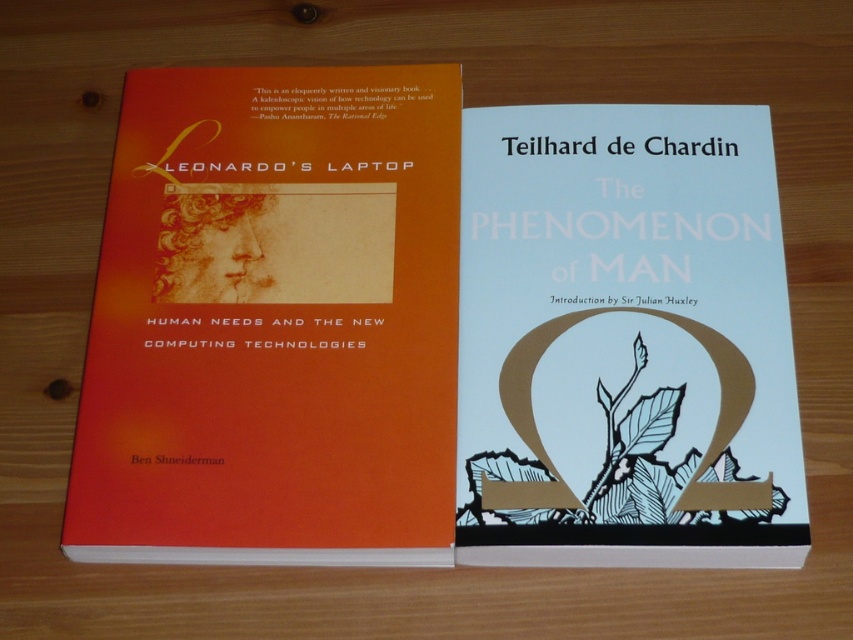
You have a bookshelf with a shelf that can only hold books up to the width of the white paper book at center. Can the orange matte book cover at left fit on this shelf?

The orange matte book cover at left is wider than the white paper book at center, so it cannot fit on the shelf designed for the white paper book at center.

You are organizing a library shelf and need to place the orange matte book cover at left and the white paper book at center. According to their positions in the image, which book should you place first on the shelf if you want them arranged from left to right as shown?

The orange matte book cover at left should be placed first on the left side since it is positioned on the left side of the white paper book at center in the image.